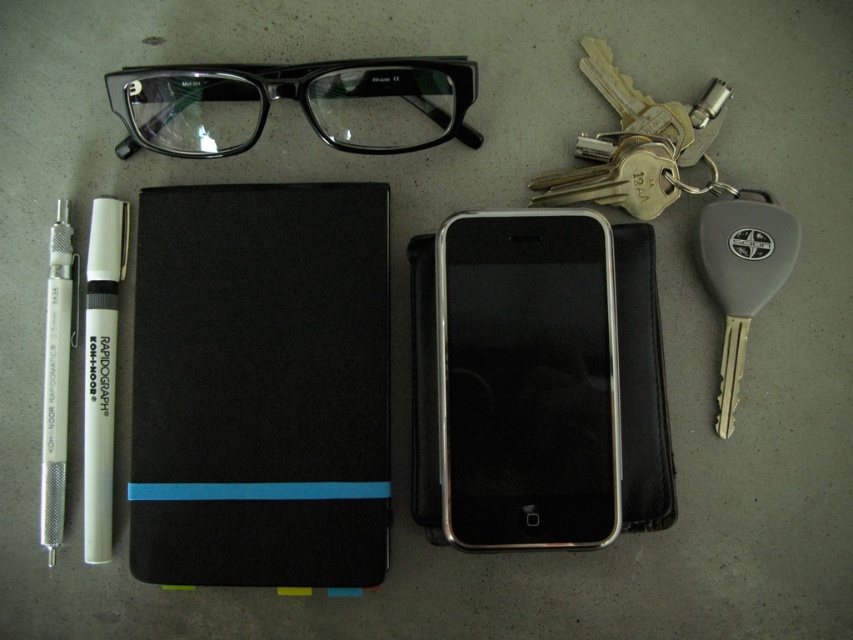
Question: Which point is closer to the camera?

Choices:
 (A) (256, 410)
 (B) (386, 97)

Answer: (A)

Question: Which of the following is the closest to the observer?

Choices:
 (A) (233, 474)
 (B) (103, 257)
 (C) (567, 300)
 (D) (67, 202)

Answer: (A)

Question: Is transparent plastic glasses at top closer to the viewer compared to white matte pen at left?

Choices:
 (A) no
 (B) yes

Answer: (B)

Question: Observing the image, what is the correct spatial positioning of transparent plastic glasses at top in reference to white plastic pen at left?

Choices:
 (A) left
 (B) right

Answer: (B)

Question: Which point is farther to the camera?

Choices:
 (A) white plastic pen at left
 (B) white matte pen at left
 (C) black matte notebook at center
 (D) silver metallic smartphone at center

Answer: (B)

Question: Where is black matte notebook at center located in relation to silver metallic smartphone at center in the image?

Choices:
 (A) below
 (B) above

Answer: (A)